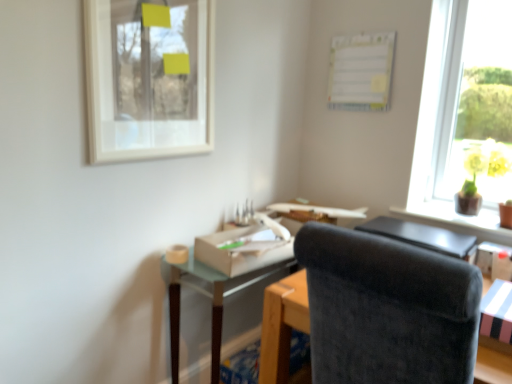
Question: Based on their sizes in the image, would you say white paperboard at upper center is bigger or smaller than yellow glossy vase at upper right?

Choices:
 (A) big
 (B) small

Answer: (B)

Question: Is white paperboard at upper center to the left or to the right of yellow glossy vase at upper right in the image?

Choices:
 (A) left
 (B) right

Answer: (A)

Question: Considering the real-world distances, which object is closest to the white paperboard at upper center?

Choices:
 (A) velvet black chair at center
 (B) white cardboard box at lower right, arranged as the first cardboard box when viewed from the right
 (C) white cardboard box at center, placed as the 2th cardboard box when sorted from front to back
 (D) black leather table at right, which is the first table in right-to-left order
 (E) white matte picture frame at upper left

Answer: (D)

Question: Which of these objects is positioned farthest from the yellow glossy vase at upper right?

Choices:
 (A) matte cardboard box at center, the first table in the left-to-right sequence
 (B) white cardboard box at center, which is the 1th cardboard box in top-to-bottom order
 (C) white paperboard at upper center
 (D) white matte picture frame at upper left
 (E) black leather table at right, the 2th table when ordered from left to right

Answer: (D)